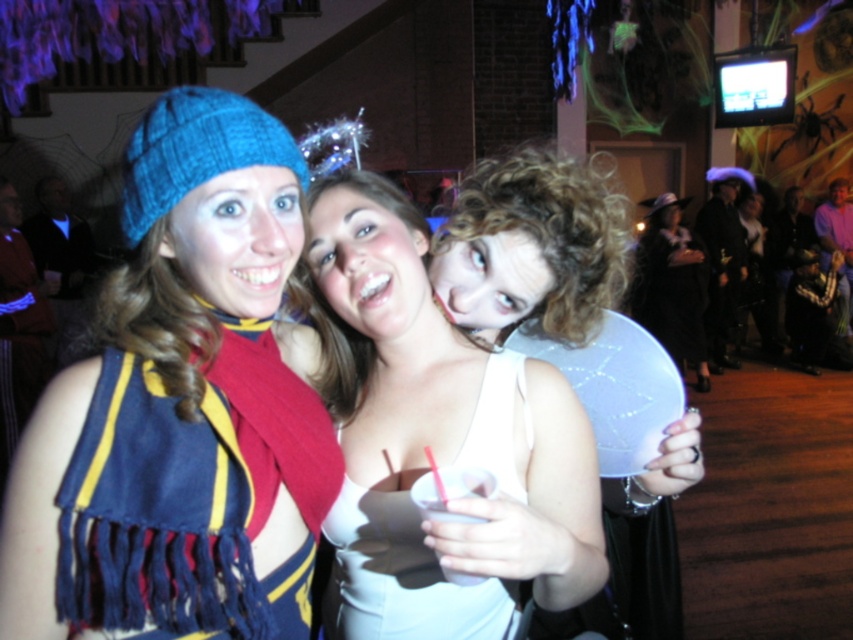
Question: Considering the relative positions of white matte tank top at center and curly hair at center in the image provided, where is white matte tank top at center located with respect to curly hair at center?

Choices:
 (A) left
 (B) right

Answer: (A)

Question: Which point appears closest to the camera in this image?

Choices:
 (A) (654, 250)
 (B) (466, 257)
 (C) (22, 461)

Answer: (C)

Question: Is white matte wings at center to the right of curly hair at center from the viewer's perspective?

Choices:
 (A) yes
 (B) no

Answer: (A)

Question: Can you confirm if white matte dress at center is positioned to the right of white matte balloon at center?

Choices:
 (A) yes
 (B) no

Answer: (B)

Question: Which point is farther to the camera?

Choices:
 (A) curly hair at center
 (B) knitted woolen hat at upper left
 (C) white matte wings at center
 (D) white matte balloon at center

Answer: (D)

Question: Which object is positioned closest to the white matte wings at center?

Choices:
 (A) white matte balloon at center
 (B) knitted woolen hat at upper left

Answer: (B)